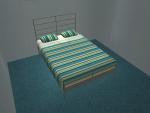
Image resolution: width=150 pixels, height=113 pixels. Identify the location of left of bed. (28, 73).